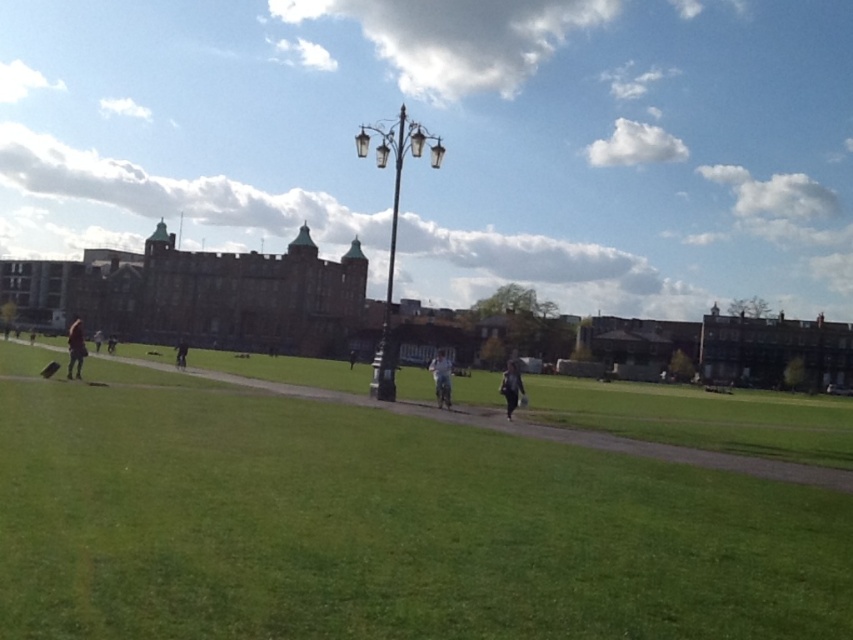
Question: In this image, where is matte brick building at center located relative to white fabric person at center?

Choices:
 (A) above
 (B) below

Answer: (A)

Question: Can you confirm if green grass at lower center is positioned to the right of black fabric person at center?

Choices:
 (A) yes
 (B) no

Answer: (B)

Question: Which point is closer to the camera?

Choices:
 (A) (111, 349)
 (B) (183, 362)
 (C) (635, 444)
 (D) (76, 358)

Answer: (C)

Question: Among these objects, which one is nearest to the camera?

Choices:
 (A) dark gray pants at left
 (B) green grass at lower center
 (C) matte brick building at center
 (D) dark gray jacket at center

Answer: (B)

Question: Can you confirm if dark gray jacket at center is smaller than black fabric person at center?

Choices:
 (A) yes
 (B) no

Answer: (B)

Question: Which of the following is the closest to the observer?

Choices:
 (A) click(180, 346)
 (B) click(544, 115)
 (C) click(352, 362)

Answer: (A)